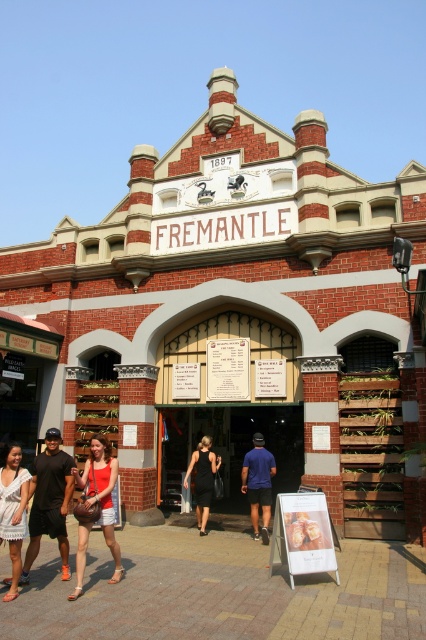
From the picture: You are standing at the entrance of the building and see the black glass door at center and the white lace dress at lower left. Which object is positioned to the right of the other?

The black glass door at center is to the right of the white lace dress at lower left.

You are standing at the entrance of the building and see the matte red tank top at center. If you move 0.1 units to the right along the horizontal axis, will you be closer to the entrance or farther away?

Moving 0.1 units to the right along the horizontal axis from the matte red tank top at center would place you farther away from the entrance since the entrance is to the left of the tank top.

You are attending a historical building tour and notice two garments in the entrance area. The first is a matte red tank top at center, and the second is a white lace dress at lower left. Which garment appears smaller in size?

The matte red tank top at center is smaller in size compared to the white lace dress at lower left.